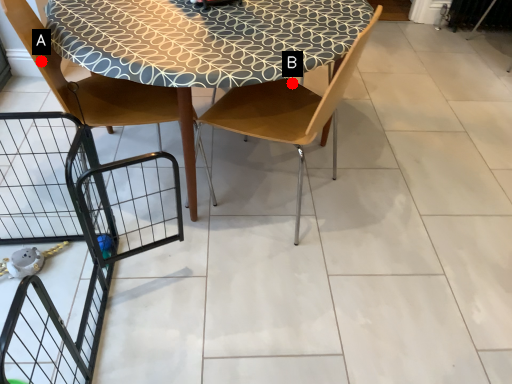
Question: Two points are circled on the image, labeled by A and B beside each circle. Which point is closer to the camera?

Choices:
 (A) A is closer
 (B) B is closer

Answer: (A)